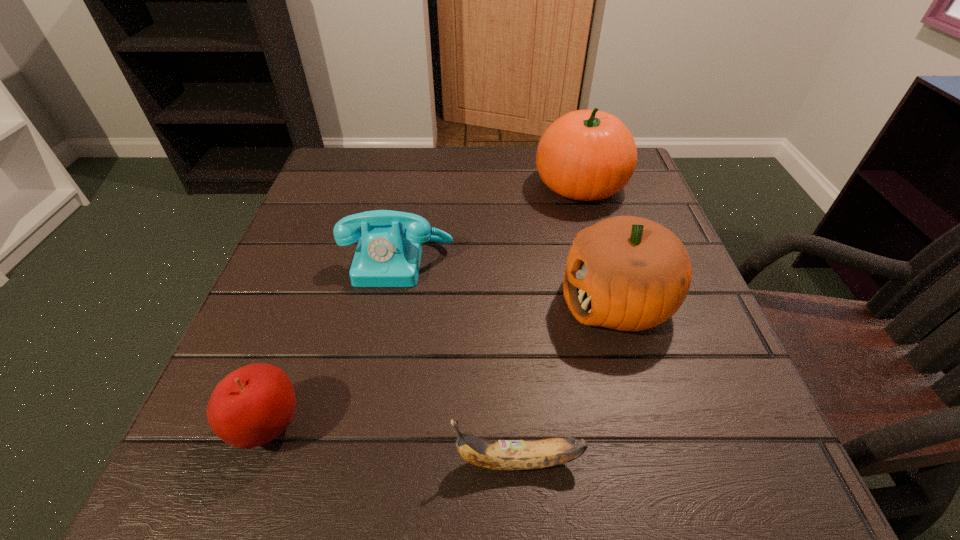
Locate an element on the screen. The height and width of the screenshot is (540, 960). free region located 0.060m on the right of the apple is located at coordinates (348, 427).

You are a GUI agent. You are given a task and a screenshot of the screen. Output one action in this format:
    pyautogui.click(x=<x>, y=<y>)
    Task: Click on the vacant space positioned 0.160m on the peel of the shortest object
    The height and width of the screenshot is (540, 960).
    Given the screenshot: What is the action you would take?
    pyautogui.click(x=333, y=461)

Find the location of a particular element. This screenshot has width=960, height=540. vacant region located 0.350m on the peel of the shortest object is located at coordinates (190, 461).

Find the location of a particular element. vacant space located 0.290m on the peel of the shortest object is located at coordinates (235, 461).

Locate an element on the screen. This screenshot has width=960, height=540. object located in the far edge section of the desktop is located at coordinates (586, 155).

Find the location of a particular element. The width and height of the screenshot is (960, 540). apple situated at the near edge is located at coordinates (251, 406).

You are a GUI agent. You are given a task and a screenshot of the screen. Output one action in this format:
    pyautogui.click(x=<x>, y=<y>)
    Task: Click on the banana located in the near edge section of the desktop
    The width and height of the screenshot is (960, 540).
    Given the screenshot: What is the action you would take?
    pyautogui.click(x=510, y=455)

I want to click on telephone located in the left edge section of the desktop, so click(388, 254).

Locate an element on the screen. This screenshot has width=960, height=540. apple that is positioned at the left edge is located at coordinates (251, 406).

Image resolution: width=960 pixels, height=540 pixels. I want to click on object at the near left corner, so click(x=251, y=406).